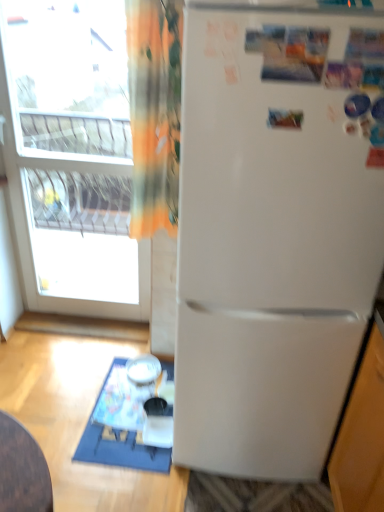
Where is `vacant area on top of white plastic table at lower left (from a real-world perspective)`? Image resolution: width=384 pixels, height=512 pixels. vacant area on top of white plastic table at lower left (from a real-world perspective) is located at coordinates (133, 407).